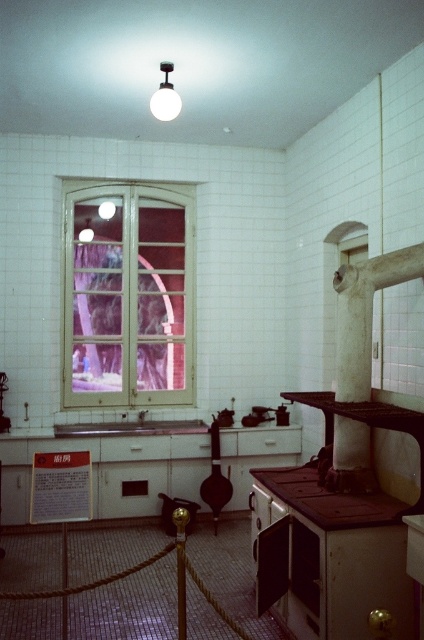
Question: Observing the image, what is the correct spatial positioning of white wooden window at center in reference to brown matte stove at lower right?

Choices:
 (A) above
 (B) below

Answer: (A)

Question: Does white wooden window at center have a greater width compared to white glossy sink at center?

Choices:
 (A) yes
 (B) no

Answer: (B)

Question: Which is nearer to the brown matte stove at lower right?

Choices:
 (A) white glossy sink at center
 (B) white wooden window at center

Answer: (A)

Question: Which of the following is the closest to the observer?

Choices:
 (A) brown matte stove at lower right
 (B) white wooden window at center

Answer: (A)

Question: Estimate the real-world distances between objects in this image. Which object is farther from the white wooden window at center?

Choices:
 (A) brown matte stove at lower right
 (B) white glossy sink at center

Answer: (A)

Question: Is white wooden window at center positioned at the back of brown matte stove at lower right?

Choices:
 (A) no
 (B) yes

Answer: (B)